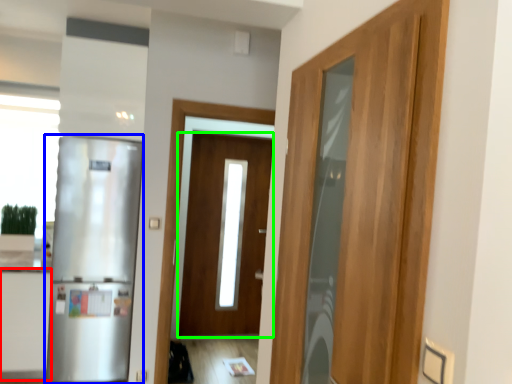
Question: Which object is the farthest from cabinetry (highlighted by a red box)? Choose among these: refrigerator (highlighted by a blue box) or door (highlighted by a green box).

Choices:
 (A) refrigerator
 (B) door

Answer: (B)